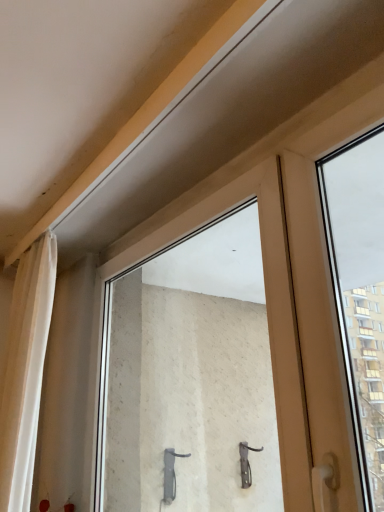
Question: Is white sheer curtain at left bigger or smaller than transparent glass window at center?

Choices:
 (A) big
 (B) small

Answer: (B)

Question: In terms of height, does white sheer curtain at left look taller or shorter compared to transparent glass window at center?

Choices:
 (A) short
 (B) tall

Answer: (B)

Question: Is white sheer curtain at left wider or thinner than transparent glass window at center?

Choices:
 (A) thin
 (B) wide

Answer: (B)

Question: From the image's perspective, is transparent glass window at center above or below white sheer curtain at left?

Choices:
 (A) below
 (B) above

Answer: (B)

Question: Looking at the image, does transparent glass window at center seem bigger or smaller compared to white sheer curtain at left?

Choices:
 (A) small
 (B) big

Answer: (B)

Question: Based on their positions, is transparent glass window at center located to the left or right of white sheer curtain at left?

Choices:
 (A) left
 (B) right

Answer: (B)

Question: Which is correct: transparent glass window at center is inside white sheer curtain at left, or outside of it?

Choices:
 (A) inside
 (B) outside

Answer: (B)